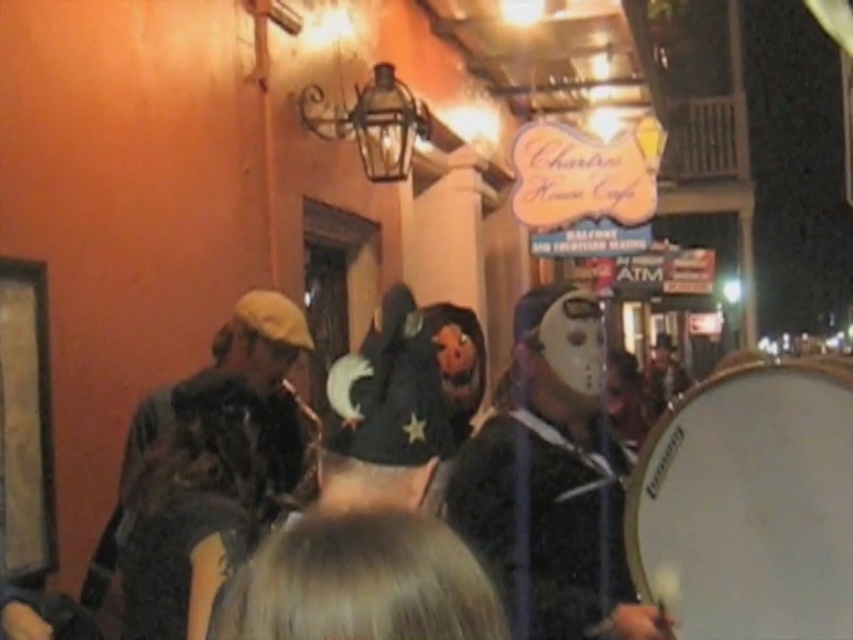
The image size is (853, 640). What do you see at coordinates (750, 502) in the screenshot?
I see `white drum at right` at bounding box center [750, 502].

Is point (724, 634) less distant than point (585, 534)?

That is True.

Locate an element on the screen. Image resolution: width=853 pixels, height=640 pixels. white drum at right is located at coordinates (750, 502).

The height and width of the screenshot is (640, 853). Find the location of `white drum at right`. white drum at right is located at coordinates (750, 502).

This screenshot has width=853, height=640. What do you see at coordinates (210, 472) in the screenshot? I see `dark brown leather jacket at left` at bounding box center [210, 472].

Can you confirm if dark brown leather jacket at left is bigger than matte black drum at right?

Indeed, dark brown leather jacket at left has a larger size compared to matte black drum at right.

Is point (236, 346) positioned behind point (509, 508)?

That is True.

You are a GUI agent. You are given a task and a screenshot of the screen. Output one action in this format:
    pyautogui.click(x=<x>, y=<y>)
    Task: Click on the dark brown leather jacket at left
    
    Given the screenshot: What is the action you would take?
    pyautogui.click(x=210, y=472)

Who is taller, white drum at right or dark brown leather jacket at left?

Standing taller between the two is dark brown leather jacket at left.

Who is shorter, white drum at right or dark brown leather jacket at left?

white drum at right

Identify the location of white drum at right. The width and height of the screenshot is (853, 640). (750, 502).